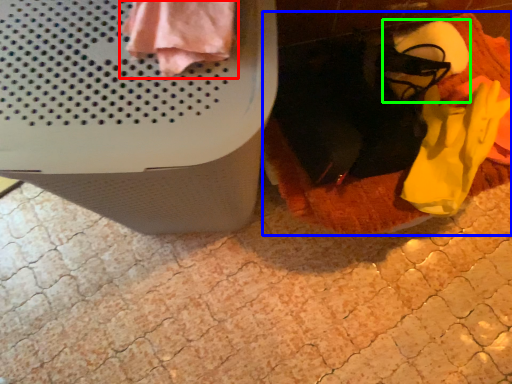
Question: Considering the real-world distances, which object is closest to clothing (highlighted by a red box)? blanket (highlighted by a blue box) or footwear (highlighted by a green box).

Choices:
 (A) blanket
 (B) footwear

Answer: (A)